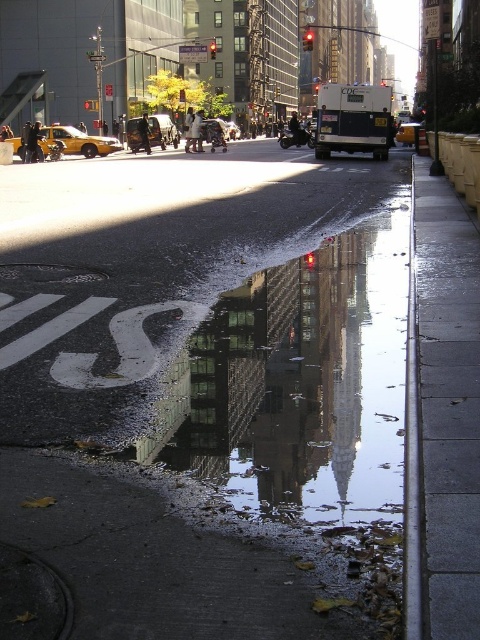
You are a photographer standing on the sidewalk and want to capture both the reflective glass building at center and the yellow rubber taxi at left in one shot. Which object will appear larger in the photo?

The reflective glass building at center will appear larger in the photo because it is closer to the photographer than the yellow rubber taxi at left.

You are a delivery person carrying a heavy package and need to walk from the sidewalk to the van. Given that the wet asphalt sidewalk at lower center is under the metallic silver van at center, can you safely step onto the sidewalk without getting too close to the van?

The wet asphalt sidewalk at lower center is positioned under the metallic silver van at center, so stepping onto the sidewalk would place you directly underneath the van, which is unsafe due to the risk of objects falling or the van moving. Choose a safer path away from the van.